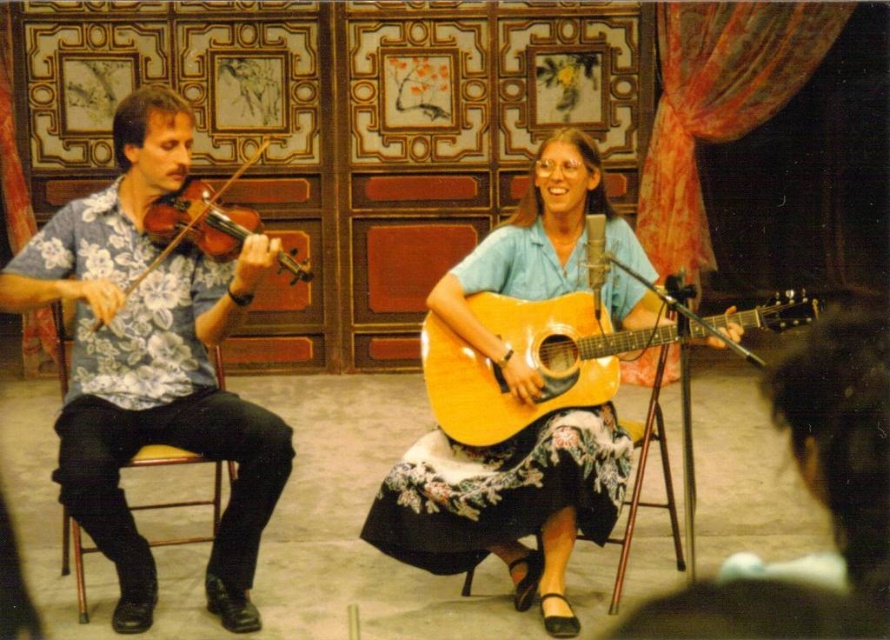
You are a stagehand setting up for a performance. You have to place the light blue fabric guitar at center and the yellow wood chair at left. Given that the stage has limited space, which object requires more space due to its size?

The light blue fabric guitar at center requires more space because it is bigger than the yellow wood chair at left.

What is the coordinate of the light blue fabric guitar at center?

The light blue fabric guitar at center is located at coordinate point (507,502).

What is the 2D coordinate of the light blue fabric guitar at center?

The light blue fabric guitar at center is located at the 2D coordinate point of (507, 502).